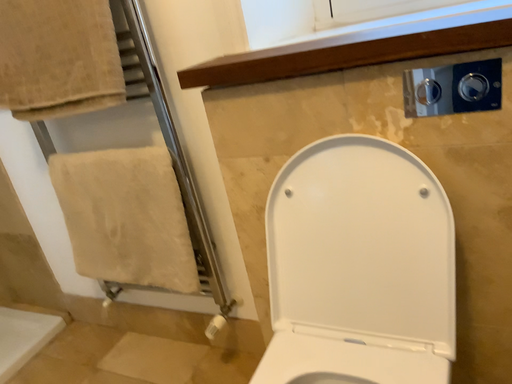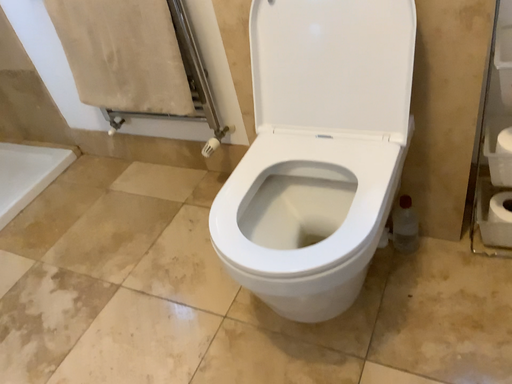
Question: Which way did the camera rotate in the video?

Choices:
 (A) rotated upward
 (B) rotated downward

Answer: (B)